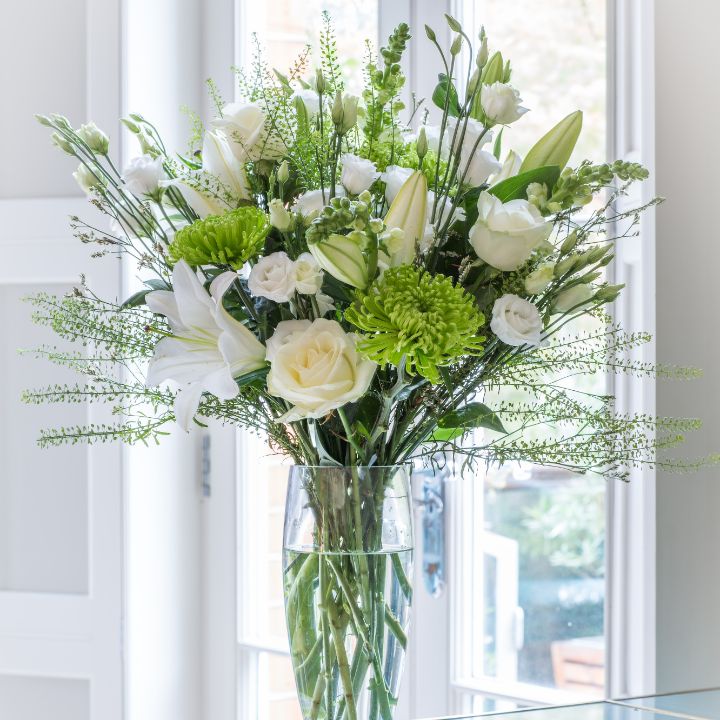
This screenshot has width=720, height=720. What are the coordinates of `doors` in the screenshot? It's located at (276, 26), (549, 42).